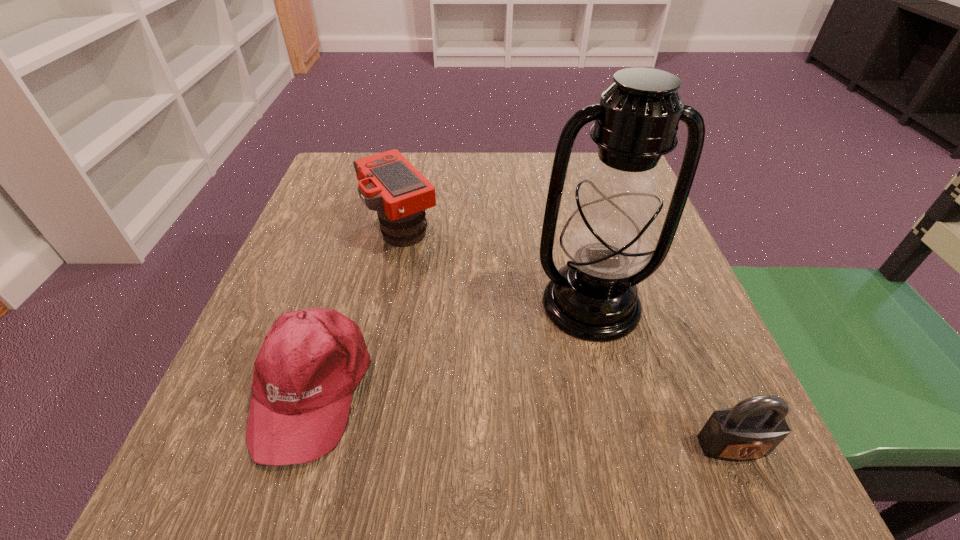
Where is `the tallest object`? This screenshot has width=960, height=540. the tallest object is located at coordinates (608, 238).

This screenshot has height=540, width=960. What are the coordinates of `camera` in the screenshot? It's located at (388, 183).

Identify the location of padlock. The image size is (960, 540). (753, 428).

At what (x,y) coordinates should I click in order to perform the action: click on baseball cap. Please return your answer as a coordinate pair (x, y). The width and height of the screenshot is (960, 540). Looking at the image, I should click on (311, 361).

This screenshot has height=540, width=960. I want to click on free spot located on the left of the oil lamp, so click(408, 304).

Find the location of a particular element. The height and width of the screenshot is (540, 960). free space located on the front of the camera is located at coordinates (386, 296).

What are the coordinates of `object at the far edge` in the screenshot? It's located at (388, 183).

Locate an element on the screen. This screenshot has width=960, height=540. padlock at the near edge is located at coordinates (753, 428).

You are a GUI agent. You are given a task and a screenshot of the screen. Output one action in this format:
    pyautogui.click(x=<x>, y=<y>)
    Task: Click on the baseball cap that is at the near edge
    Image resolution: width=960 pixels, height=540 pixels.
    Given the screenshot: What is the action you would take?
    pyautogui.click(x=311, y=361)

You are a GUI agent. You are given a task and a screenshot of the screen. Output one action in this format:
    pyautogui.click(x=<x>, y=<y>)
    Task: Click on the camera that is at the left edge
    
    Given the screenshot: What is the action you would take?
    pyautogui.click(x=388, y=183)